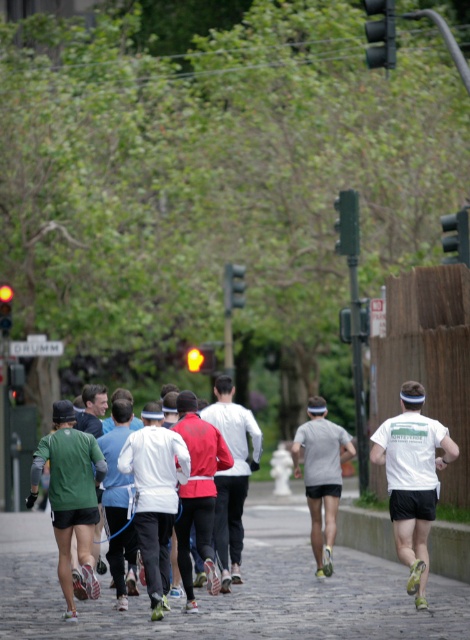
In the scene shown: Can you confirm if green matte running shirt at left is smaller than green matte traffic light at upper right?

Indeed, green matte running shirt at left has a smaller size compared to green matte traffic light at upper right.

In the scene shown: Between green matte running shirt at left and green matte traffic light at upper right, which one appears on the left side from the viewer's perspective?

Positioned to the left is green matte running shirt at left.

Measure the distance between point (x=78, y=444) and camera.

A distance of 15.38 meters exists between point (x=78, y=444) and camera.

Where is `green matte running shirt at left`? This screenshot has height=640, width=470. green matte running shirt at left is located at coordinates (70, 496).

Between black plastic traffic light at center and yellow glass traffic light at upper left, which one has more height?

black plastic traffic light at center is taller.

Between point (226, 266) and point (4, 300), which one is positioned in front?

Point (4, 300) is more forward.

The image size is (470, 640). In order to click on black plastic traffic light at center in this screenshot , I will do `click(234, 285)`.

Does red matte jacket at center have a greater width compared to black plastic traffic light at upper right?

Indeed, red matte jacket at center has a greater width compared to black plastic traffic light at upper right.

Is point (226, 401) farther from viewer compared to point (385, 61)?

No, it is not.

The width and height of the screenshot is (470, 640). What do you see at coordinates (232, 476) in the screenshot?
I see `red matte jacket at center` at bounding box center [232, 476].

You are a GUI agent. You are given a task and a screenshot of the screen. Output one action in this format:
    pyautogui.click(x=<x>, y=<y>)
    Task: Click on the red matte jacket at center
    Image resolution: width=470 pixels, height=640 pixels.
    Given the screenshot: What is the action you would take?
    pyautogui.click(x=232, y=476)